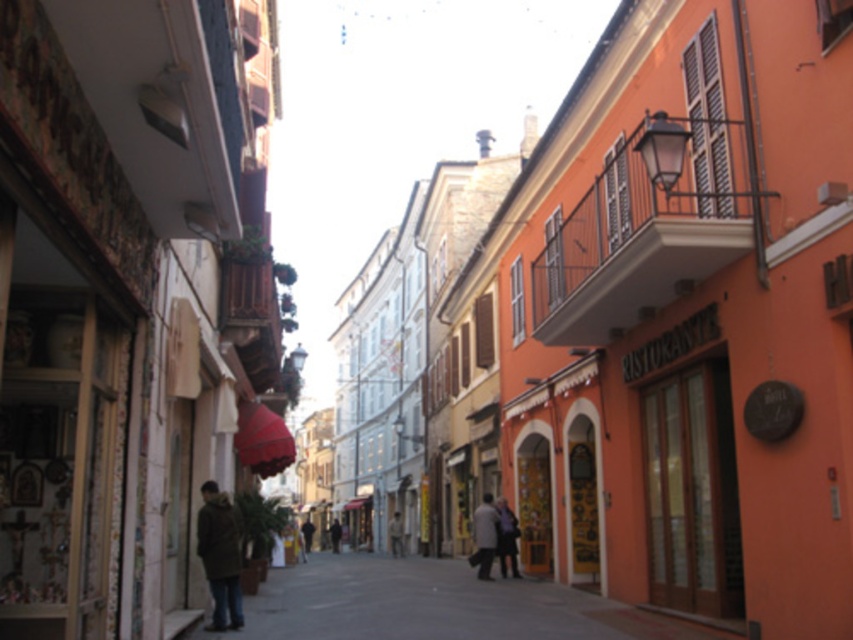
Which is in front, point (496, 518) or point (334, 524)?

Point (496, 518)

Can you confirm if light gray fabric coat at center is positioned to the right of dark gray coat at center?

Indeed, light gray fabric coat at center is positioned on the right side of dark gray coat at center.

Image resolution: width=853 pixels, height=640 pixels. I want to click on light gray fabric coat at center, so click(485, 536).

Between point (491, 493) and point (508, 522), which one is positioned in front?

Point (508, 522) is in front.

I want to click on light gray fabric coat at center, so point(485,536).

This screenshot has width=853, height=640. I want to click on light gray fabric coat at center, so click(485, 536).

Is dark green textured coat at lower left to the right of light gray fabric coat at center from the viewer's perspective?

No, dark green textured coat at lower left is not to the right of light gray fabric coat at center.

Can you confirm if dark green textured coat at lower left is bigger than light gray fabric coat at center?

Yes.

Which is in front, point (216, 609) or point (492, 540)?

Point (216, 609) is in front.

This screenshot has height=640, width=853. Identify the location of dark green textured coat at lower left. (219, 556).